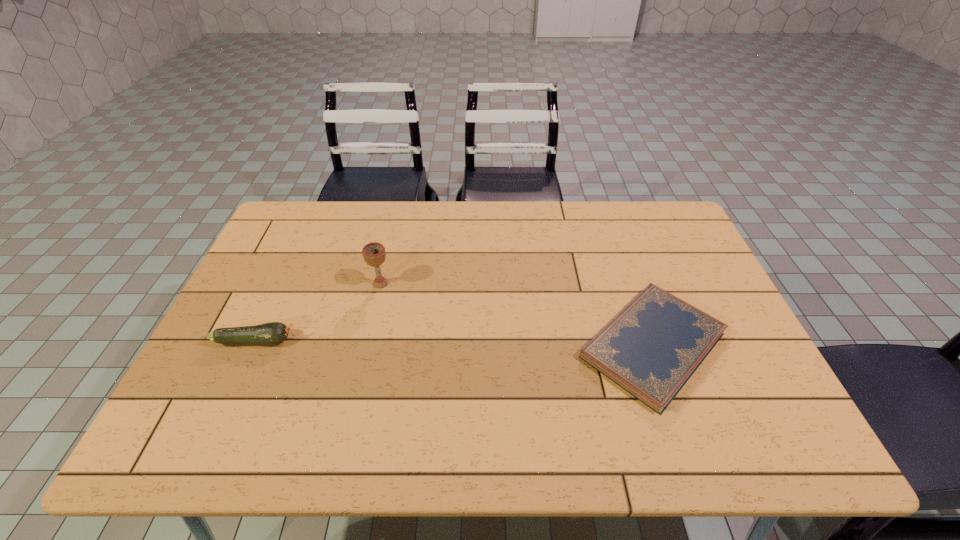
Where is `object present at the right edge`? object present at the right edge is located at coordinates [651, 348].

At what (x,y) coordinates should I click in order to perform the action: click on blank area at the far edge. Please return your answer as a coordinate pair (x, y). Looking at the image, I should click on (571, 206).

Identify the location of vacant space at the right edge of the desktop. (708, 285).

The height and width of the screenshot is (540, 960). I want to click on vacant area at the far left corner of the desktop, so click(316, 221).

Find the location of a particular element. The height and width of the screenshot is (540, 960). free space at the far right corner of the desktop is located at coordinates (665, 242).

At what (x,y) coordinates should I click in order to perform the action: click on vacant space at the near right corner of the desktop. Please return your answer as a coordinate pair (x, y). The image size is (960, 540). Looking at the image, I should click on (735, 420).

Where is `free area in between the tallest object and the zucchini`? This screenshot has width=960, height=540. free area in between the tallest object and the zucchini is located at coordinates (318, 312).

Find the location of `free spot between the chalice and the second tallest object`. free spot between the chalice and the second tallest object is located at coordinates (318, 312).

At what (x,y) coordinates should I click in order to perform the action: click on empty space that is in between the paperback book and the zucchini. Please return your answer as a coordinate pair (x, y). Looking at the image, I should click on [454, 343].

Identify the location of vacant space that is in between the rightmost object and the zucchini. This screenshot has height=540, width=960. (454, 343).